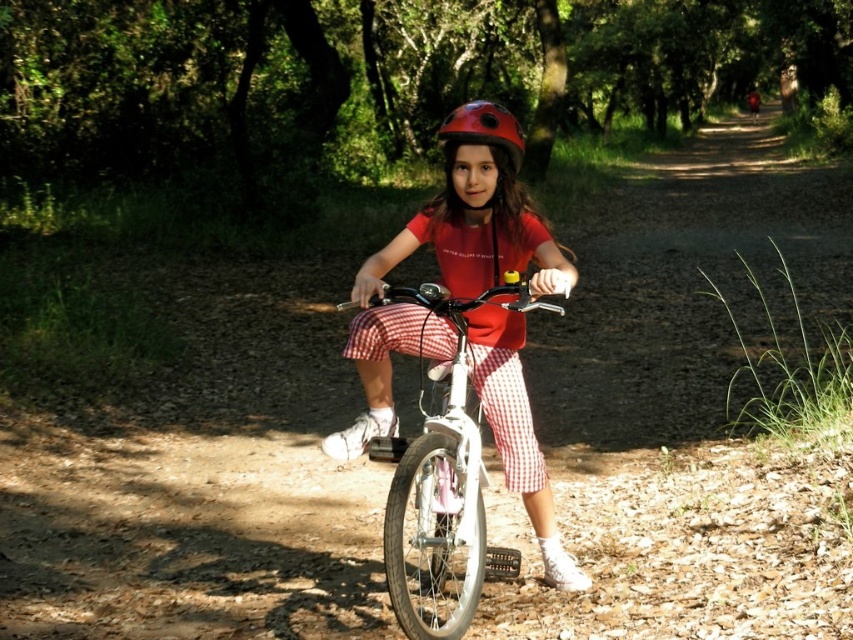
Is white matte bicycle at center further to camera compared to shiny red helmet at center?

No.

Who is more forward, (x=424, y=508) or (x=517, y=172)?

Point (x=424, y=508) is in front.

In order to click on white matte bicycle at center in this screenshot , I will do `click(442, 481)`.

Locate an element on the screen. This screenshot has height=640, width=853. white matte bicycle at center is located at coordinates (442, 481).